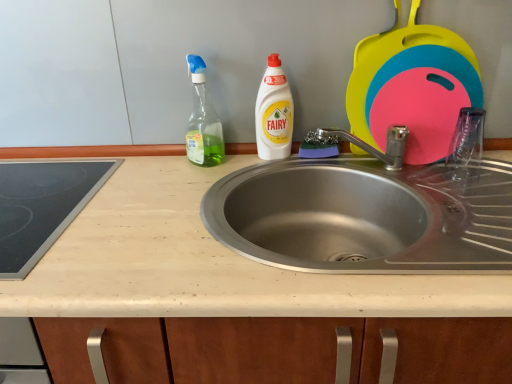
Question: Considering the relative sizes of green glass spray bottle at upper left, which is the 2th cleaning product in right-to-left order, and black glass cooktop at left in the image provided, is green glass spray bottle at upper left, which is the 2th cleaning product in right-to-left order, taller than black glass cooktop at left?

Choices:
 (A) no
 (B) yes

Answer: (B)

Question: Can you see green glass spray bottle at upper left, which is the 2th cleaning product in right-to-left order, touching black glass cooktop at left?

Choices:
 (A) yes
 (B) no

Answer: (B)

Question: Does green glass spray bottle at upper left, which is the 2th cleaning product in right-to-left order, have a lesser height compared to black glass cooktop at left?

Choices:
 (A) yes
 (B) no

Answer: (B)

Question: Does green glass spray bottle at upper left, which is the 2th cleaning product in right-to-left order, have a greater width compared to black glass cooktop at left?

Choices:
 (A) yes
 (B) no

Answer: (B)

Question: Is green glass spray bottle at upper left, placed as the 1th cleaning product when sorted from left to right, facing towards black glass cooktop at left?

Choices:
 (A) no
 (B) yes

Answer: (B)

Question: Is green glass spray bottle at upper left, placed as the 1th cleaning product when sorted from left to right, at the right side of black glass cooktop at left?

Choices:
 (A) yes
 (B) no

Answer: (A)

Question: From the image's perspective, is green glass spray bottle at upper left, placed as the 1th cleaning product when sorted from left to right, located beneath beige laminate countertop at center?

Choices:
 (A) yes
 (B) no

Answer: (B)

Question: Is beige laminate countertop at center a part of green glass spray bottle at upper left, placed as the 1th cleaning product when sorted from left to right?

Choices:
 (A) yes
 (B) no

Answer: (B)

Question: Can you confirm if green glass spray bottle at upper left, placed as the 1th cleaning product when sorted from left to right, is shorter than beige laminate countertop at center?

Choices:
 (A) yes
 (B) no

Answer: (A)

Question: Can you confirm if green glass spray bottle at upper left, placed as the 1th cleaning product when sorted from left to right, is wider than beige laminate countertop at center?

Choices:
 (A) yes
 (B) no

Answer: (B)

Question: From a real-world perspective, is green glass spray bottle at upper left, placed as the 1th cleaning product when sorted from left to right, beneath beige laminate countertop at center?

Choices:
 (A) yes
 (B) no

Answer: (B)

Question: Is green glass spray bottle at upper left, placed as the 1th cleaning product when sorted from left to right, facing towards beige laminate countertop at center?

Choices:
 (A) no
 (B) yes

Answer: (A)

Question: From the image's perspective, would you say beige laminate countertop at center is shown under black glass cooktop at left?

Choices:
 (A) yes
 (B) no

Answer: (A)